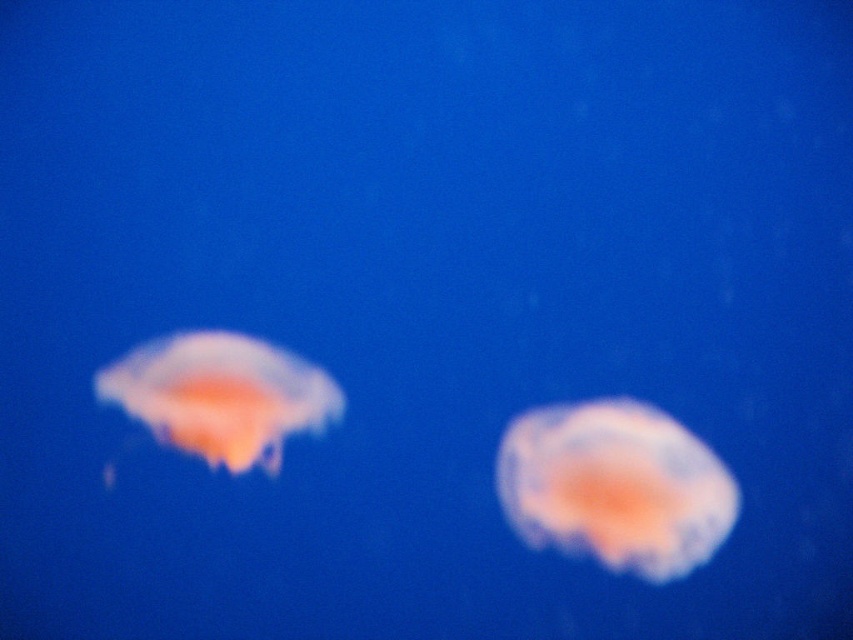
Question: Is translucent orange jellyfish at center to the left of translucent orange jellyfish at left from the viewer's perspective?

Choices:
 (A) no
 (B) yes

Answer: (A)

Question: Which object is farther from the camera taking this photo?

Choices:
 (A) translucent orange jellyfish at center
 (B) translucent orange jellyfish at left

Answer: (B)

Question: Which point appears closest to the camera in this image?

Choices:
 (A) (192, 362)
 (B) (631, 570)

Answer: (B)

Question: Is translucent orange jellyfish at center thinner than translucent orange jellyfish at left?

Choices:
 (A) yes
 (B) no

Answer: (A)

Question: Does translucent orange jellyfish at center appear on the left side of translucent orange jellyfish at left?

Choices:
 (A) yes
 (B) no

Answer: (B)